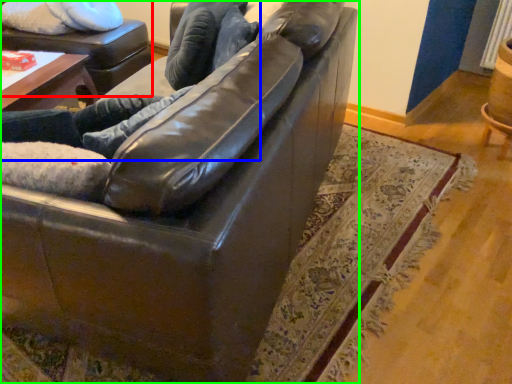
Question: Considering the real-world distances, which object is farthest from swivel chair (highlighted by a red box)? couple (highlighted by a blue box) or studio couch (highlighted by a green box)?

Choices:
 (A) couple
 (B) studio couch

Answer: (B)